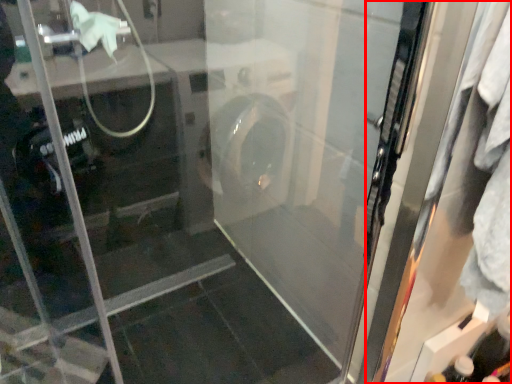
Question: From the image's perspective, where is screen door (annotated by the red box) located relative to bottle?

Choices:
 (A) below
 (B) above

Answer: (B)